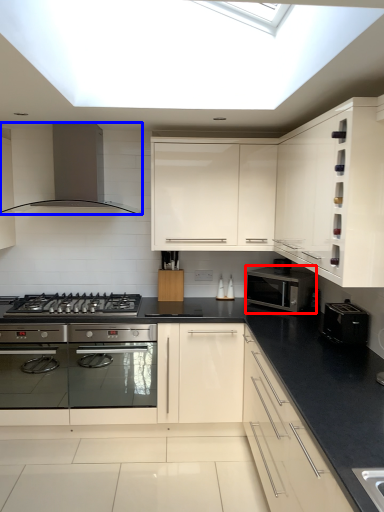
Question: Which point is closer to the camera, microwave oven (highlighted by a red box) or home appliance (highlighted by a blue box)?

Choices:
 (A) microwave oven
 (B) home appliance

Answer: (B)